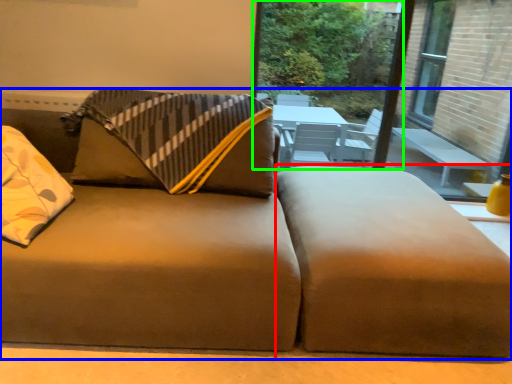
Question: Which is nearer to the footrest (highlighted by a red box)? studio couch (highlighted by a blue box) or window screen (highlighted by a green box).

Choices:
 (A) studio couch
 (B) window screen

Answer: (A)